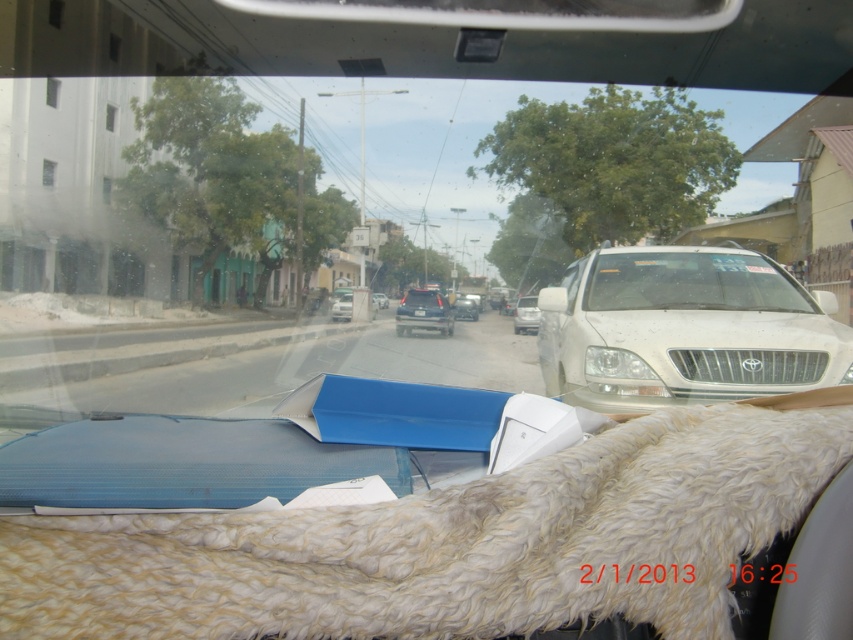
Question: Which of the following is the closest to the observer?

Choices:
 (A) satin silver car at center
 (B) white matte sedan at center
 (C) satin silver sedan at center

Answer: (B)

Question: Which object is the farthest from the satin silver sedan at center?

Choices:
 (A) white matte sedan at center
 (B) fuzzy wool blanket at lower center
 (C) satin silver car at center

Answer: (B)

Question: Which point is closer to the camera?

Choices:
 (A) (403, 321)
 (B) (691, 268)

Answer: (B)

Question: Is satin silver sedan at center further to camera compared to satin silver car at center?

Choices:
 (A) no
 (B) yes

Answer: (A)

Question: Is satin blue sedan at center further to the viewer compared to black plastic license plate at center?

Choices:
 (A) no
 (B) yes

Answer: (A)

Question: Can you confirm if satin blue sedan at center is positioned above satin black sedan at center?

Choices:
 (A) yes
 (B) no

Answer: (A)